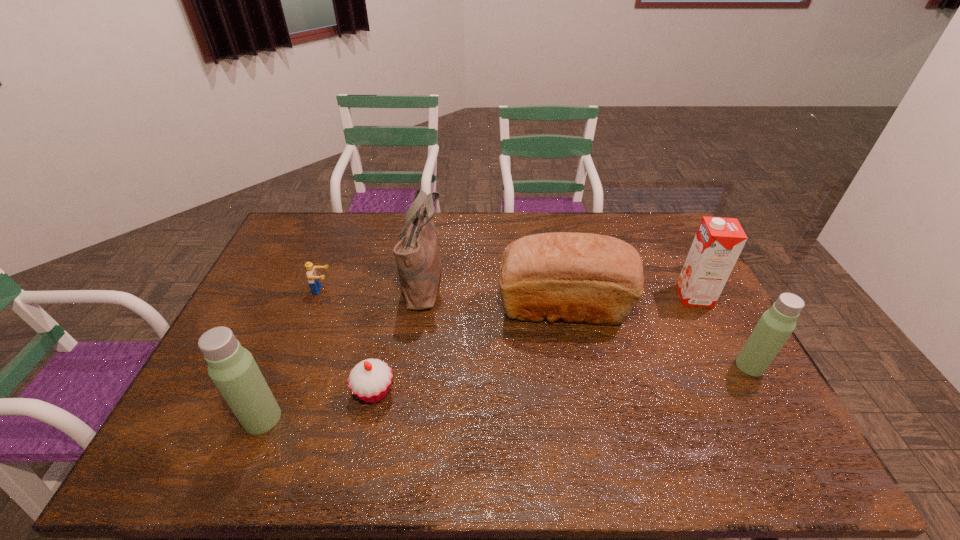
Find the location of a particular element. This screenshot has width=960, height=540. vacant space located on the left of the shorter thermos bottle is located at coordinates (674, 366).

Where is `vacant region located 0.180m on the front-facing side of the shoulder bag`? The height and width of the screenshot is (540, 960). vacant region located 0.180m on the front-facing side of the shoulder bag is located at coordinates (499, 280).

Identify the location of vacant area situated on the face of the Lego. (453, 290).

The image size is (960, 540). Find the location of `free space located on the left of the cupcake`. free space located on the left of the cupcake is located at coordinates point(216,392).

This screenshot has width=960, height=540. Identify the location of vacant position located 0.310m on the back of the bread. (548, 230).

This screenshot has width=960, height=540. Identify the location of vacant space located 0.100m on the left of the carton. (647, 296).

This screenshot has height=540, width=960. I want to click on object that is at the far edge, so click(417, 258).

This screenshot has height=540, width=960. In order to click on thermos bottle that is positioned at the near edge in this screenshot , I will do `click(232, 368)`.

Find the location of a particular element. The width and height of the screenshot is (960, 540). cupcake that is positioned at the near edge is located at coordinates (370, 380).

The width and height of the screenshot is (960, 540). I want to click on object at the left edge, so click(232, 368).